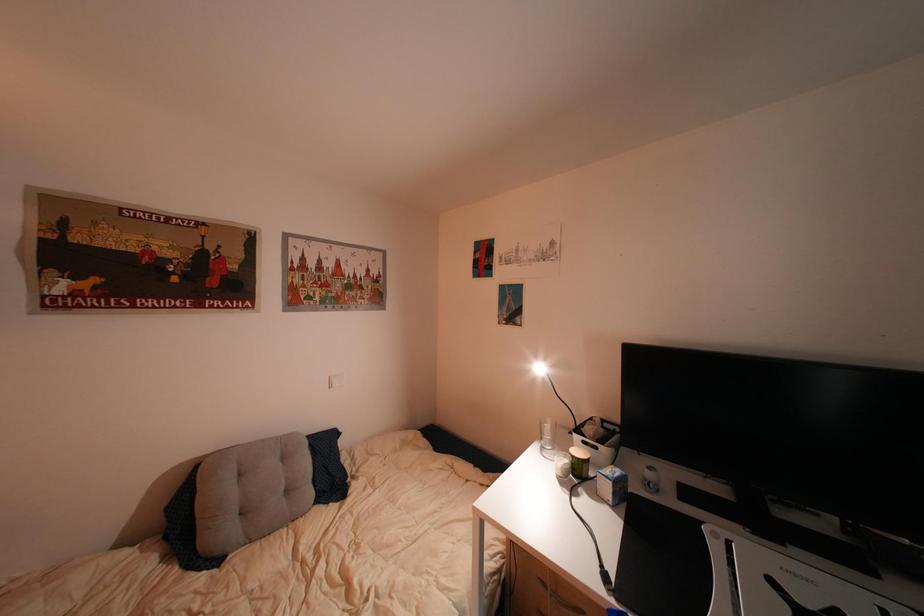
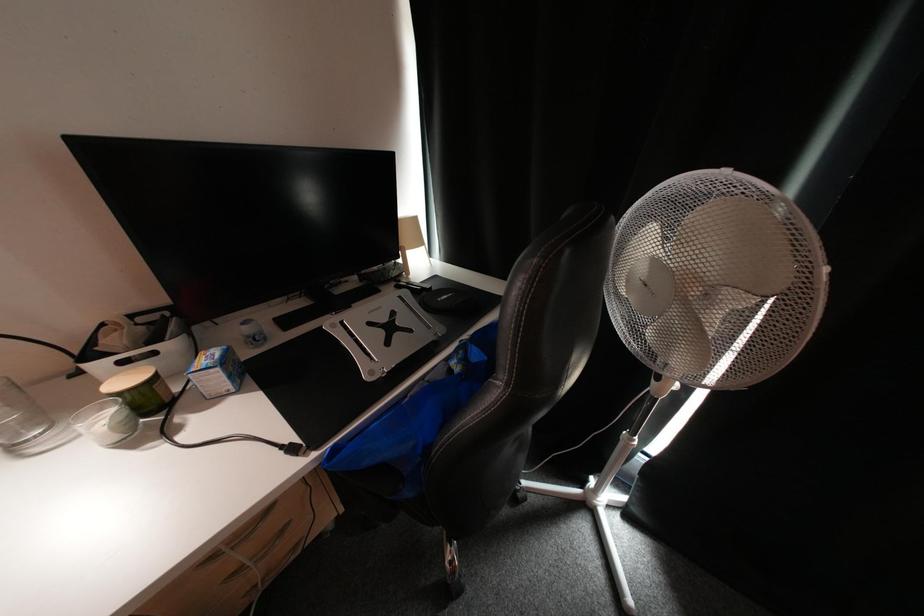
How did the camera likely rotate?

The rotation direction of the camera is right-down.